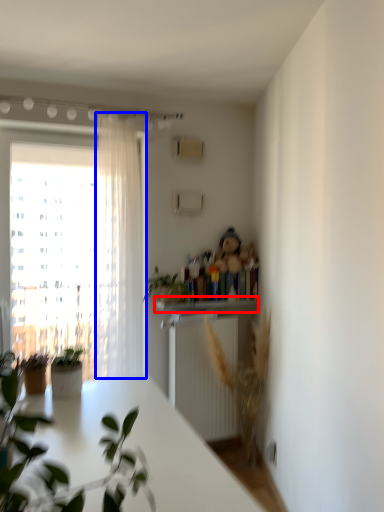
Question: Which point is further to the camera, window sill (highlighted by a red box) or curtain (highlighted by a blue box)?

Choices:
 (A) window sill
 (B) curtain

Answer: (A)